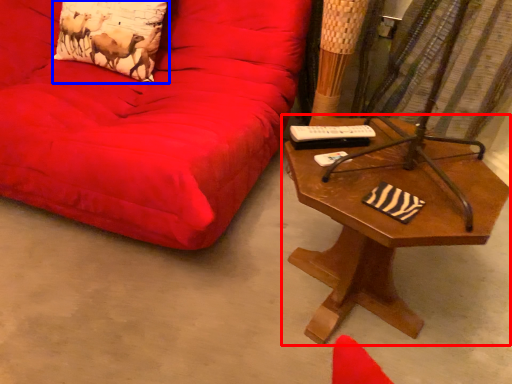
Question: Which object appears closest to the camera in this image, table (highlighted by a red box) or pillow (highlighted by a blue box)?

Choices:
 (A) table
 (B) pillow

Answer: (A)